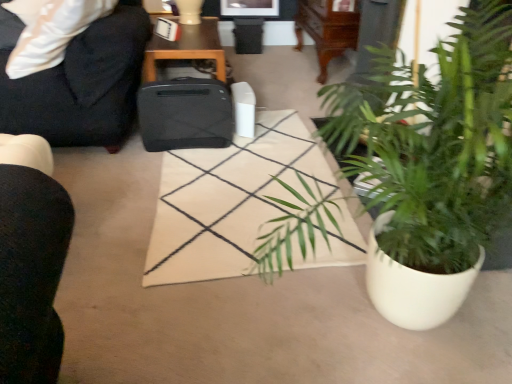
Question: Is black plastic trash can at center taller or shorter than black matte suitcase at center?

Choices:
 (A) tall
 (B) short

Answer: (B)

Question: Does point (253, 51) appear closer or farther from the camera than point (190, 119)?

Choices:
 (A) closer
 (B) farther

Answer: (B)

Question: Considering the real-world distances, which object is farthest from the black matte printer at center?

Choices:
 (A) black matte suitcase at center
 (B) black fabric chair at upper left
 (C) black wood table at upper center
 (D) green leafy plant in white pot at lower right
 (E) black plastic trash can at center

Answer: (E)

Question: Which object is positioned farthest from the black matte suitcase at center?

Choices:
 (A) green leafy plant in white pot at lower right
 (B) black fabric chair at upper left
 (C) black plastic trash can at center
 (D) black wood table at upper center
 (E) black matte printer at center

Answer: (C)